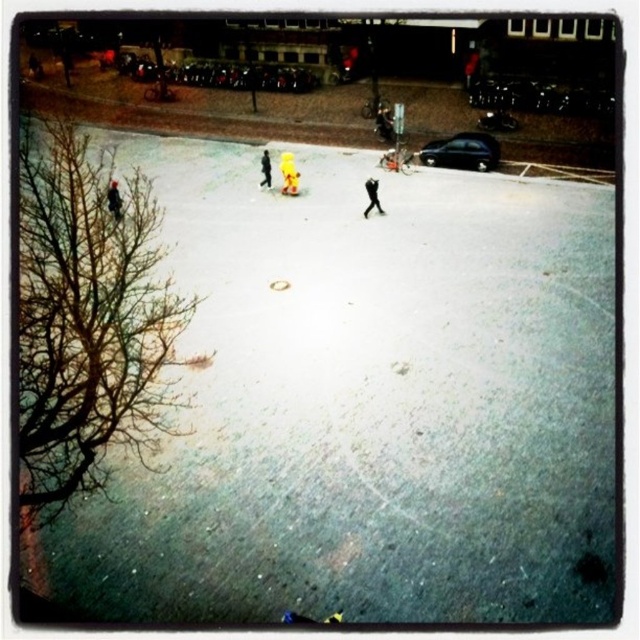
Between yellow matte person at center and dark gray jacket at left, which one is positioned lower?

dark gray jacket at left is below.

The image size is (640, 640). I want to click on yellow matte person at center, so click(289, 173).

Between point (291, 176) and point (115, 216), which one is positioned in front?

Point (115, 216) is in front.

This screenshot has width=640, height=640. Find the location of `yellow matte person at center`. yellow matte person at center is located at coordinates (289, 173).

Who is positioned more to the right, black matte figure at center or dark gray jacket at left?

black matte figure at center

Can you confirm if black matte figure at center is smaller than dark gray jacket at left?

Yes, black matte figure at center is smaller than dark gray jacket at left.

This screenshot has width=640, height=640. What do you see at coordinates (371, 196) in the screenshot?
I see `black matte figure at center` at bounding box center [371, 196].

At what (x,y) coordinates should I click in order to perform the action: click on black matte figure at center. Please return your answer as a coordinate pair (x, y). The image size is (640, 640). Looking at the image, I should click on (371, 196).

Can you confirm if black matte figure at center is positioned to the left of yellow fabric at center?

No, black matte figure at center is not to the left of yellow fabric at center.

Can you confirm if black matte figure at center is wider than yellow fabric at center?

Yes.

Is point (365, 218) positioned in front of point (268, 157)?

That is True.

The height and width of the screenshot is (640, 640). In order to click on black matte figure at center in this screenshot , I will do `click(371, 196)`.